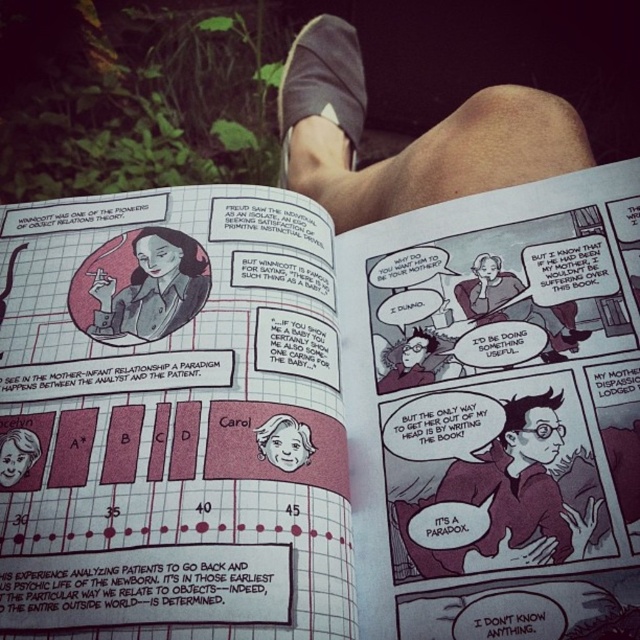
Question: Does dark purple textured shirt at center appear on the left side of matte black comic book page at center?

Choices:
 (A) yes
 (B) no

Answer: (A)

Question: Which object appears closest to the camera in this image?

Choices:
 (A) brown suede shoe at upper center
 (B) smooth skin face at center
 (C) matte black comic book page at center

Answer: (B)

Question: Does dark purple textured shirt at center have a smaller size compared to matte brown jacket at center-left?

Choices:
 (A) no
 (B) yes

Answer: (A)

Question: Is matte black comic book page at center in front of smooth skin face at center?

Choices:
 (A) no
 (B) yes

Answer: (A)

Question: Which point appears closest to the camera in this image?

Choices:
 (A) (186, 285)
 (B) (317, 76)
 (C) (458, 560)

Answer: (C)

Question: Estimate the real-world distances between objects in this image. Which object is closer to the matte brown jacket at center-left?

Choices:
 (A) brown suede shoe at upper center
 (B) dark purple textured shirt at center
 (C) smooth skin face at center

Answer: (C)